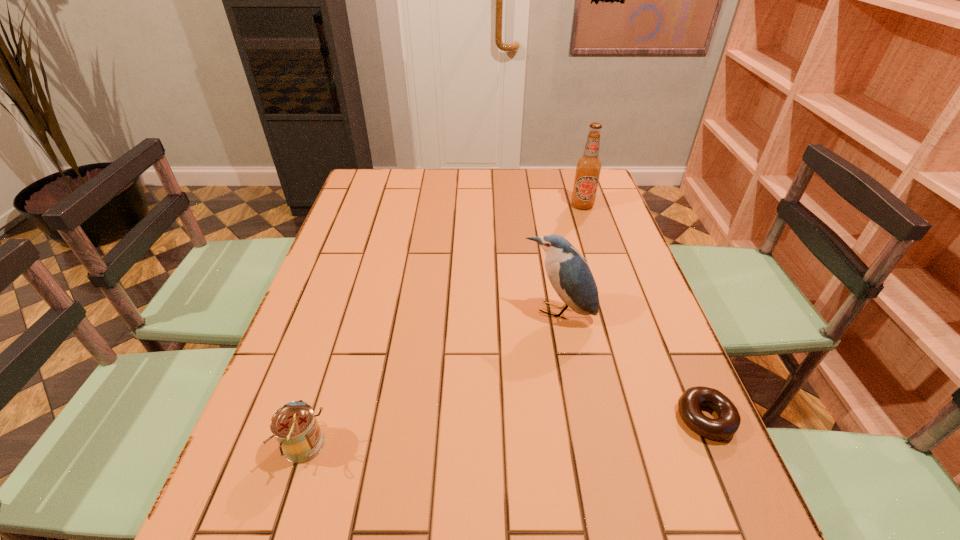
The height and width of the screenshot is (540, 960). In order to click on vacant space located on the front label of the farthest object in this screenshot , I will do `click(575, 235)`.

I want to click on free space located 0.350m on the front label of the farthest object, so click(564, 278).

Locate an element on the screen. The image size is (960, 540). vacant area located 0.060m on the front label of the farthest object is located at coordinates (578, 221).

Find the location of a particular element. vacant space situated at the tip of the bird's beak is located at coordinates (536, 347).

Where is `vacant space located at the tip of the bird's beak`? Image resolution: width=960 pixels, height=540 pixels. vacant space located at the tip of the bird's beak is located at coordinates (511, 401).

Locate an element on the screen. The width and height of the screenshot is (960, 540). free space located at the tip of the bird's beak is located at coordinates (497, 429).

At what (x,y) coordinates should I click in order to perform the action: click on object that is at the far edge. Please return your answer as a coordinate pair (x, y). Looking at the image, I should click on (588, 167).

Identify the location of object present at the near edge. (294, 425).

What are the coordinates of `object present at the left edge` in the screenshot? It's located at (294, 425).

You are a GUI agent. You are given a task and a screenshot of the screen. Output one action in this format:
    pyautogui.click(x=<x>, y=<y>)
    Task: Click on the doughnut that is at the right edge
    
    Given the screenshot: What is the action you would take?
    pyautogui.click(x=728, y=422)